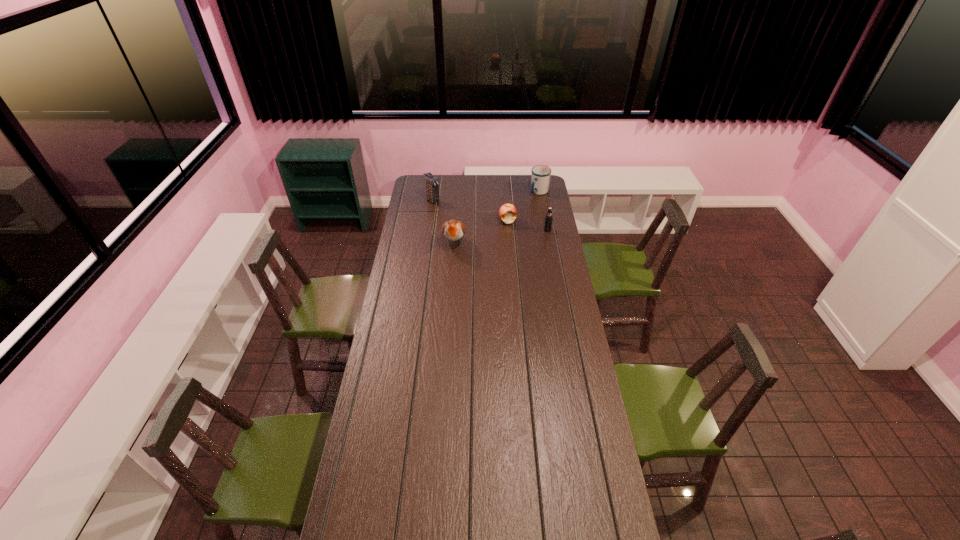
I want to click on bird, so click(x=453, y=230).

At what (x,y) coordinates should I click in order to perform the action: click on pop. Please return your answer as a coordinate pair (x, y). This screenshot has height=540, width=960. Looking at the image, I should click on (548, 219).

Locate an element on the screen. This screenshot has height=540, width=960. mug is located at coordinates (540, 177).

Locate an element on the screen. This screenshot has height=540, width=960. the shortest object is located at coordinates (507, 213).

The image size is (960, 540). Identify the location of the third farthest object. (507, 213).

Locate an element on the screen. The height and width of the screenshot is (540, 960). the leftmost object is located at coordinates (431, 182).

Where is `free point located 0.230m at the face of the bird`? This screenshot has height=540, width=960. free point located 0.230m at the face of the bird is located at coordinates (451, 286).

Where is `vacant position located on the front label of the pop`? The height and width of the screenshot is (540, 960). vacant position located on the front label of the pop is located at coordinates (553, 261).

Locate an element on the screen. vacant space located on the handle side of the mug is located at coordinates (531, 204).

Where is `free spot located on the handle side of the mug`? The height and width of the screenshot is (540, 960). free spot located on the handle side of the mug is located at coordinates 521,215.